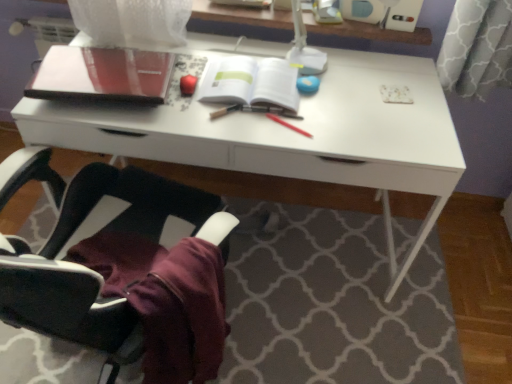
Where is `vacant space in between red matte pen at center, positioned as the 3th stationery in left-to-right order, and glossy red apple at upper center, marked as the third stationery in a right-to-left arrangement`? The width and height of the screenshot is (512, 384). vacant space in between red matte pen at center, positioned as the 3th stationery in left-to-right order, and glossy red apple at upper center, marked as the third stationery in a right-to-left arrangement is located at coordinates (245, 114).